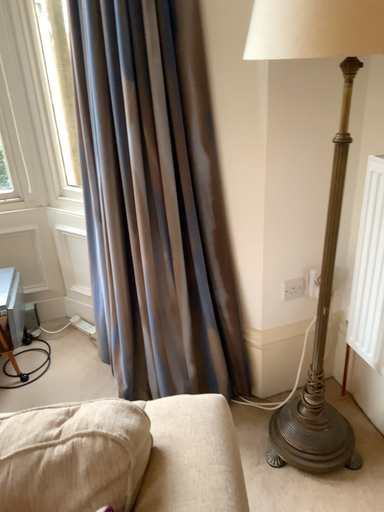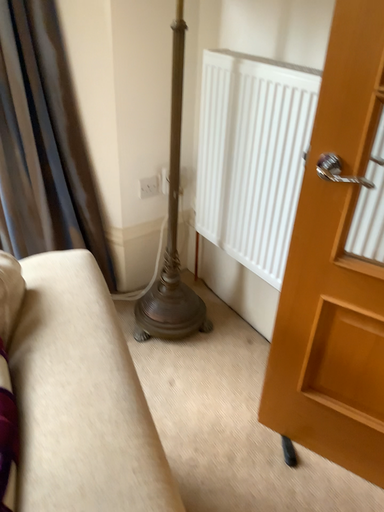
Question: How did the camera likely rotate when shooting the video?

Choices:
 (A) rotated upward
 (B) rotated downward

Answer: (B)